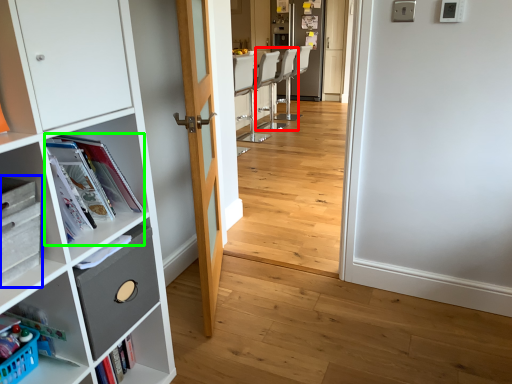
Question: Considering the real-world distances, which object is farthest from armchair (highlighted by a red box)? cabinetry (highlighted by a blue box) or magazine (highlighted by a green box)?

Choices:
 (A) cabinetry
 (B) magazine

Answer: (A)